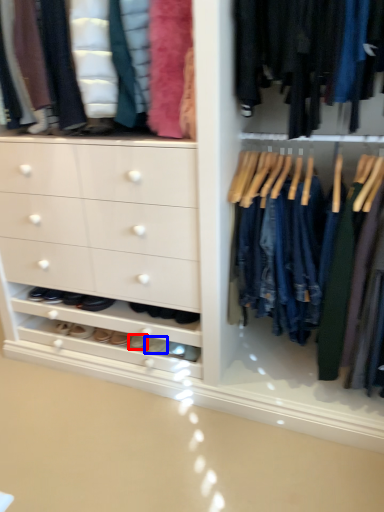
Question: Which point is further to the camera, footwear (highlighted by a red box) or footwear (highlighted by a blue box)?

Choices:
 (A) footwear
 (B) footwear

Answer: (A)